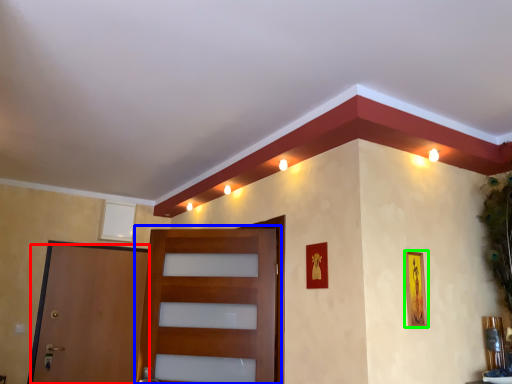
Question: Estimate the real-world distances between objects in this image. Which object is closer to door (highlighted by a red box), door (highlighted by a blue box) or picture frame (highlighted by a green box)?

Choices:
 (A) door
 (B) picture frame

Answer: (A)